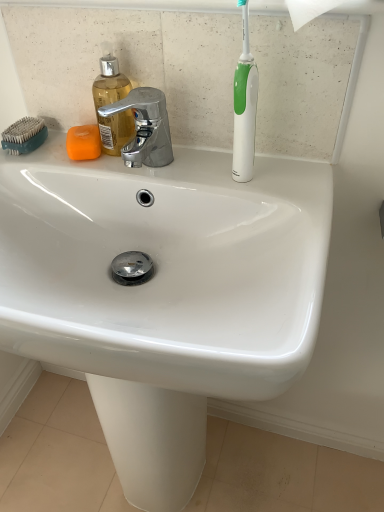
Identify the location of vacant region in front of white glossy toothbrush at upper right. The image size is (384, 512). pos(279,218).